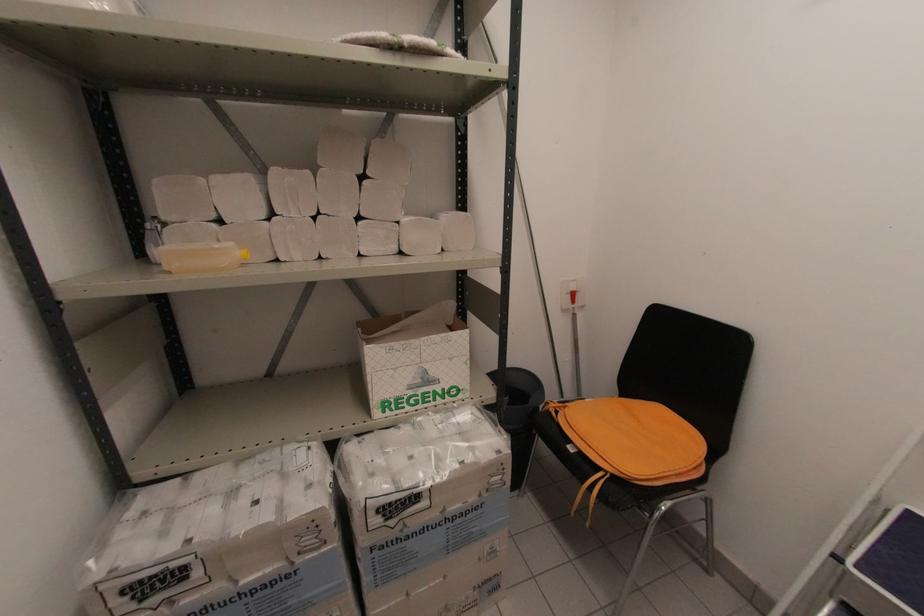
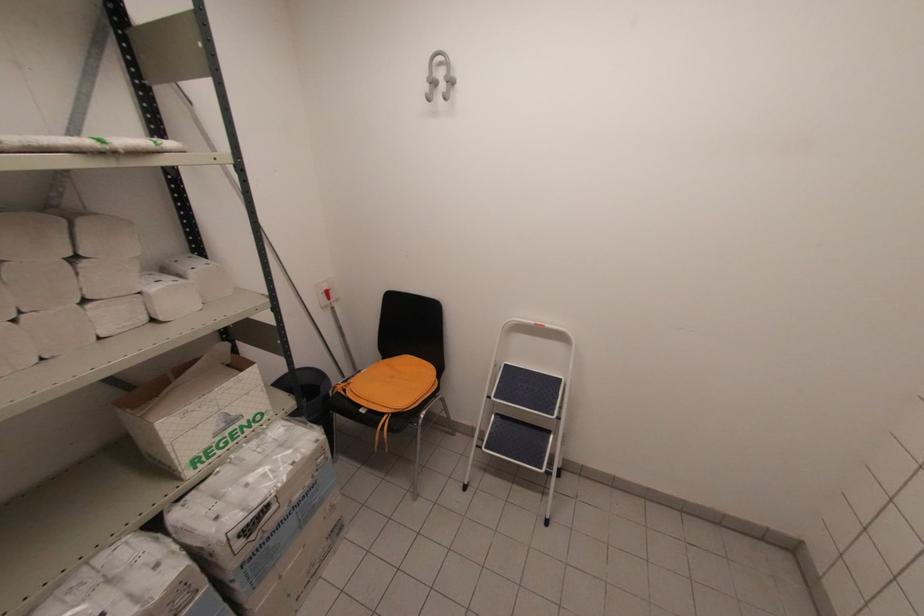
Question: The camera is either moving clockwise (left) or counter-clockwise (right) around the object. The first image is from the beginning of the video and the second image is from the end. Is the camera moving left or right when shooting the video?

Choices:
 (A) Left
 (B) Right

Answer: (A)